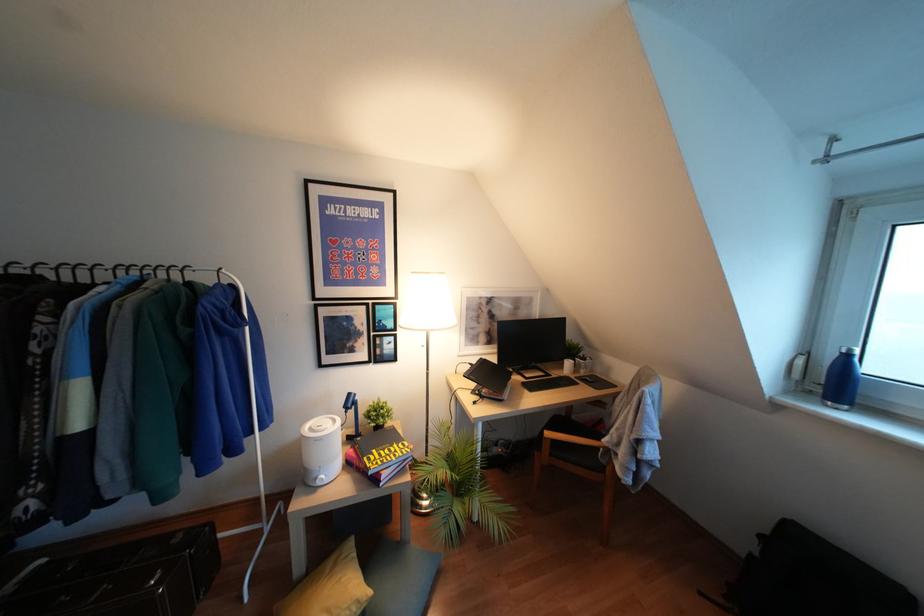
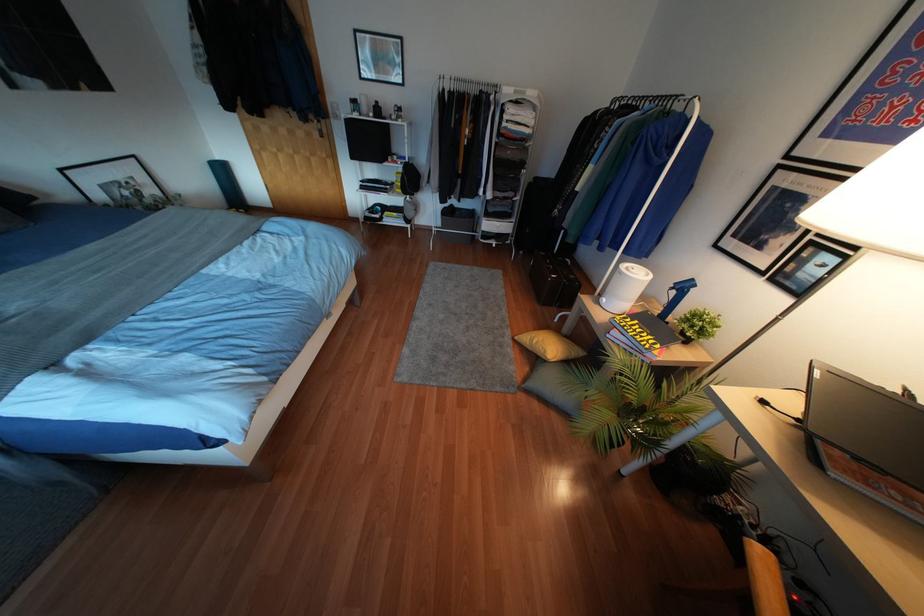
The first image is from the beginning of the video and the second image is from the end. How did the camera likely rotate when shooting the video?

The camera rotated toward left-down.